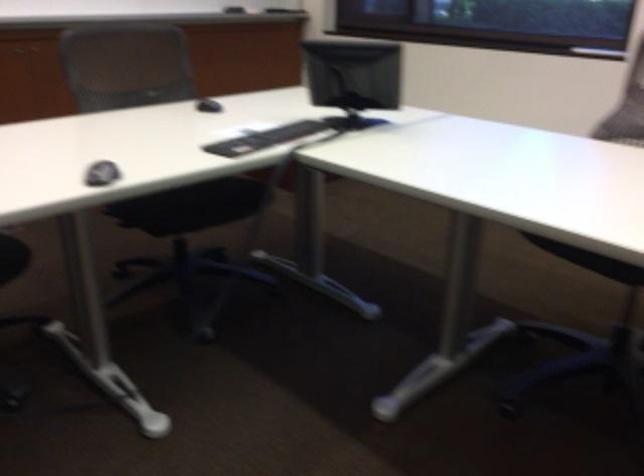
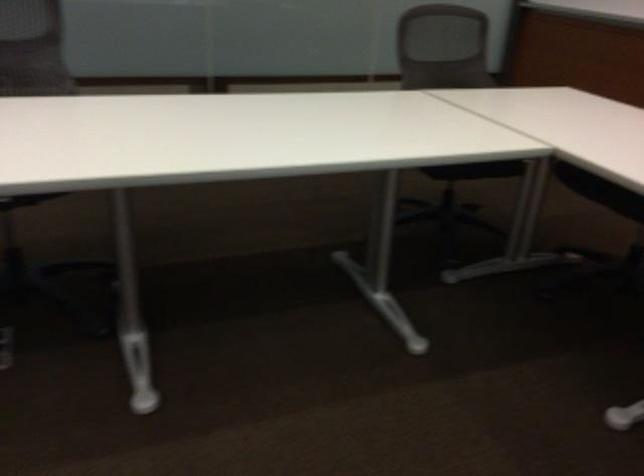
Based on the continuous images, in which direction is the camera rotating?

The camera's rotation is toward left-down.